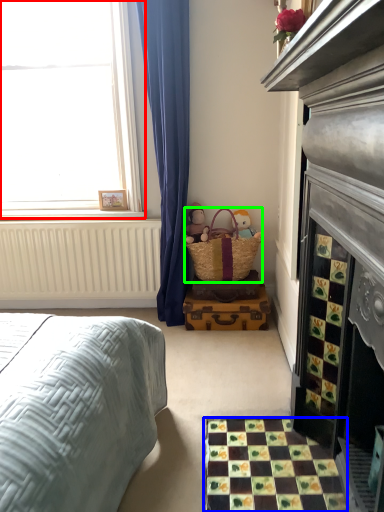
Question: Estimate the real-world distances between objects in this image. Which object is closer to window (highlighted by a red box), tile (highlighted by a blue box) or picnic basket (highlighted by a green box)?

Choices:
 (A) tile
 (B) picnic basket

Answer: (B)